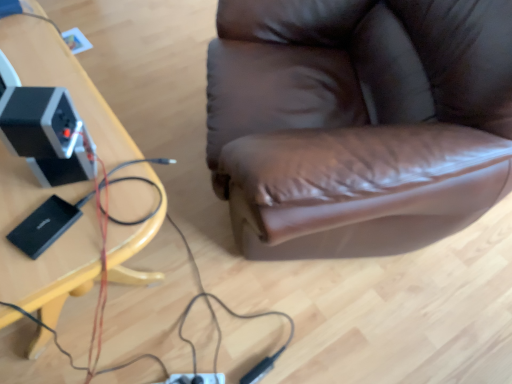
The height and width of the screenshot is (384, 512). I want to click on wooden table at left, so pos(48,248).

Describe the element at coordinates (48, 248) in the screenshot. I see `wooden table at left` at that location.

The width and height of the screenshot is (512, 384). Identify the location of black plastic speaker at left. (40, 122).

What do you see at coordinates (40, 122) in the screenshot? I see `black plastic speaker at left` at bounding box center [40, 122].

This screenshot has width=512, height=384. What are the coordinates of `wooden table at left` in the screenshot? It's located at (48, 248).

Is black plastic speaker at left at the right side of wooden table at left?

Indeed, black plastic speaker at left is positioned on the right side of wooden table at left.

Which is behind, black plastic speaker at left or wooden table at left?

black plastic speaker at left.

Does point (67, 113) come closer to viewer compared to point (89, 269)?

No, it is behind (89, 269).

Looking at this image, from the image's perspective, is black plastic speaker at left located above wooden table at left?

Yes, from the image's perspective, black plastic speaker at left is over wooden table at left.

From a real-world perspective, between black plastic speaker at left and wooden table at left, who is vertically higher?

black plastic speaker at left is physically above.

Considering the sizes of objects black plastic speaker at left and wooden table at left in the image provided, who is wider, black plastic speaker at left or wooden table at left?

wooden table at left.

Which of these two, black plastic speaker at left or wooden table at left, stands taller?

wooden table at left is taller.

Between black plastic speaker at left and wooden table at left, which one has smaller size?

black plastic speaker at left is smaller.

Is black plastic speaker at left situated inside wooden table at left or outside?

black plastic speaker at left cannot be found inside wooden table at left.

Are black plastic speaker at left and wooden table at left beside each other?

No, black plastic speaker at left is not in contact with wooden table at left.

Consider the image. Is black plastic speaker at left turned away from wooden table at left?

No, black plastic speaker at left is not facing the opposite direction of wooden table at left.

Where is `table below the black plastic speaker at left (from the image's perspective)`? table below the black plastic speaker at left (from the image's perspective) is located at coordinates (48, 248).

Which is more to the right, wooden table at left or black plastic speaker at left?

From the viewer's perspective, black plastic speaker at left appears more on the right side.

Considering the positions of objects wooden table at left and black plastic speaker at left in the image provided, who is behind, wooden table at left or black plastic speaker at left?

black plastic speaker at left is behind.

Considering the points (54, 293) and (46, 129), which point is in front, point (54, 293) or point (46, 129)?

The point (46, 129) is more forward.

From the image's perspective, who appears lower, wooden table at left or black plastic speaker at left?

wooden table at left, from the image's perspective.

From a real-world perspective, is wooden table at left below black plastic speaker at left?

Indeed, from a real-world perspective, wooden table at left is positioned beneath black plastic speaker at left.

Which of these two, wooden table at left or black plastic speaker at left, is wider?

Wider between the two is wooden table at left.

Based on the photo, is wooden table at left taller than black plastic speaker at left?

Correct, wooden table at left is much taller as black plastic speaker at left.

Is wooden table at left smaller than black plastic speaker at left?

No.

Is wooden table at left positioned beyond the bounds of black plastic speaker at left?

Yes.

Are wooden table at left and black plastic speaker at left located far from each other?

No, there isn't a large distance between wooden table at left and black plastic speaker at left.

Based on the photo, is wooden table at left facing away from black plastic speaker at left?

No, black plastic speaker at left is not at the back of wooden table at left.

How many degrees apart are the facing directions of wooden table at left and black plastic speaker at left?

wooden table at left and black plastic speaker at left are facing 57.9 degrees away from each other.

This screenshot has height=384, width=512. Identify the location of speaker on the right of wooden table at left. (40, 122).

At what (x,y) coordinates should I click in order to perform the action: click on speaker above the wooden table at left (from a real-world perspective). Please return your answer as a coordinate pair (x, y). This screenshot has width=512, height=384. Looking at the image, I should click on (40, 122).

The height and width of the screenshot is (384, 512). I want to click on table below the black plastic speaker at left (from the image's perspective), so click(48, 248).